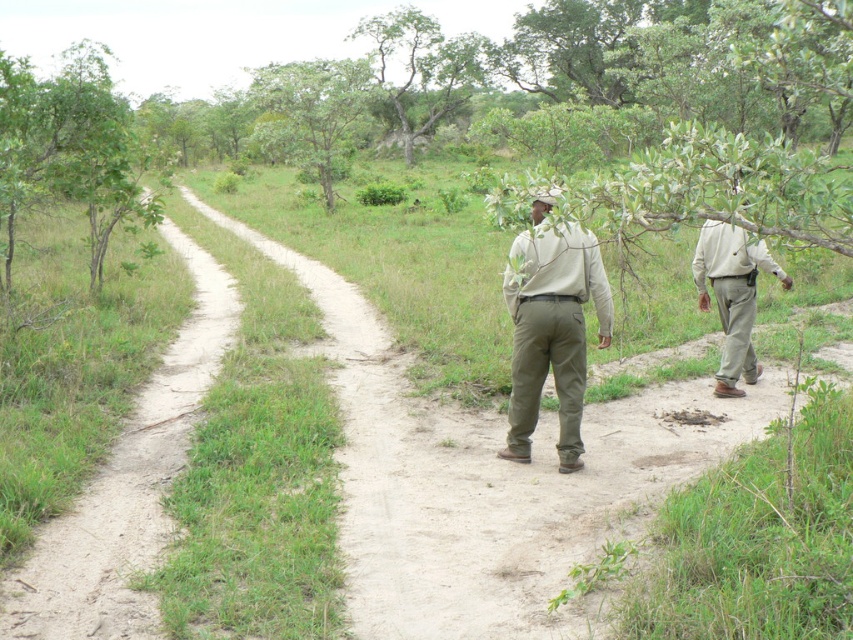
You are a hiker trying to follow the two people in the image. The khaki cotton pants at center is located at point (552, 333). Which direction should you walk to reach them?

The khaki cotton pants at center is located at point (552, 333), so you should walk towards that coordinate to reach them.

You are a photographer positioned at the starting point of the dirt path. You want to capture a photo where the khaki cotton pants at center and the green leafy tree at center are both visible. Based on their positions, which object should appear closer to the left side of the photo?

The green leafy tree at center should appear closer to the left side of the photo because the khaki cotton pants at center are positioned to the right of it.